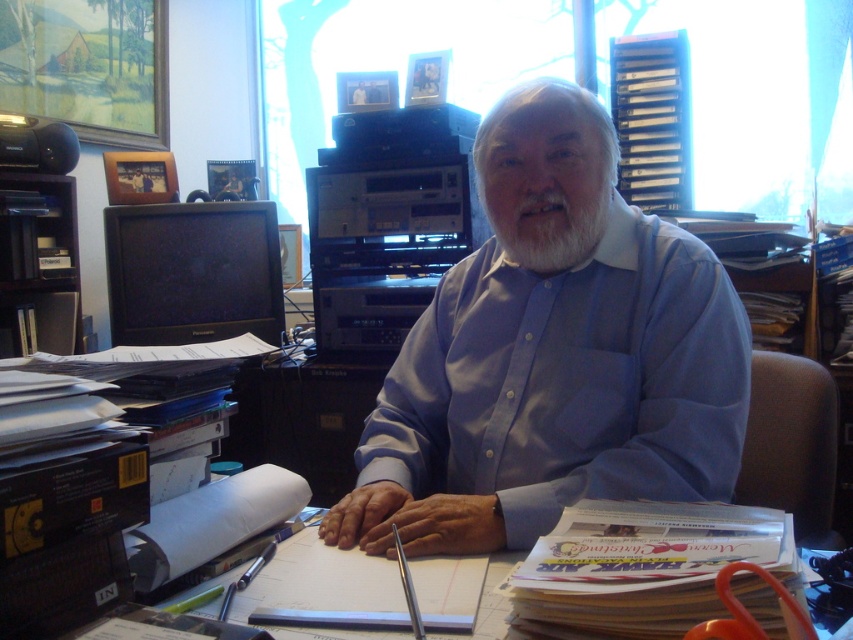
Question: Does blue smooth shirt at center appear on the right side of white soft beard at center?

Choices:
 (A) yes
 (B) no

Answer: (B)

Question: Which of the following is the farthest from the observer?

Choices:
 (A) blue smooth shirt at center
 (B) white soft beard at center

Answer: (B)

Question: Is blue smooth shirt at center to the left of white soft beard at center from the viewer's perspective?

Choices:
 (A) yes
 (B) no

Answer: (A)

Question: Which of the following is the closest to the observer?

Choices:
 (A) blue smooth shirt at center
 (B) white soft beard at center

Answer: (A)

Question: Which object appears farthest from the camera in this image?

Choices:
 (A) blue smooth shirt at center
 (B) white soft beard at center

Answer: (B)

Question: Does blue smooth shirt at center have a greater width compared to white soft beard at center?

Choices:
 (A) yes
 (B) no

Answer: (A)